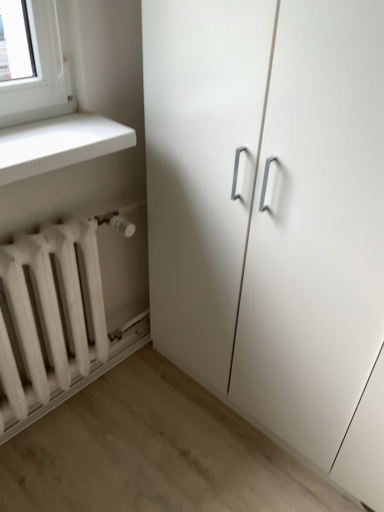
Locate an element on the screen. The width and height of the screenshot is (384, 512). white matte cabinet at center is located at coordinates (273, 217).

Describe the element at coordinates (273, 217) in the screenshot. The width and height of the screenshot is (384, 512). I see `white matte cabinet at center` at that location.

Measure the distance between white matte cabinet at center and camera.

A distance of 28.85 inches exists between white matte cabinet at center and camera.

Locate an element on the screen. The height and width of the screenshot is (512, 384). white matte radiator at lower left is located at coordinates (49, 318).

What do you see at coordinates (49, 318) in the screenshot? The width and height of the screenshot is (384, 512). I see `white matte radiator at lower left` at bounding box center [49, 318].

The width and height of the screenshot is (384, 512). Find the location of `white matte cabinet at center`. white matte cabinet at center is located at coordinates (273, 217).

Is white matte cabinet at center at the right side of white matte radiator at lower left?

Yes.

In the image, is white matte cabinet at center positioned in front of or behind white matte radiator at lower left?

Visually, white matte cabinet at center is located in front of white matte radiator at lower left.

Does point (163, 106) come farther from viewer compared to point (89, 270)?

No.

From the image's perspective, which object appears higher, white matte cabinet at center or white matte radiator at lower left?

white matte cabinet at center is shown above in the image.

From the picture: From a real-world perspective, between white matte cabinet at center and white matte radiator at lower left, who is vertically lower?

In real-world perspective, white matte radiator at lower left is lower.

Looking at their sizes, would you say white matte cabinet at center is wider or thinner than white matte radiator at lower left?

In the image, white matte cabinet at center appears to be wider than white matte radiator at lower left.

Considering the sizes of objects white matte cabinet at center and white matte radiator at lower left in the image provided, who is taller, white matte cabinet at center or white matte radiator at lower left?

Standing taller between the two is white matte cabinet at center.

Is white matte cabinet at center smaller than white matte radiator at lower left?

Actually, white matte cabinet at center might be larger than white matte radiator at lower left.

Is white matte cabinet at center inside or outside of white matte radiator at lower left?

white matte cabinet at center is not inside white matte radiator at lower left, it's outside.

Is white matte cabinet at center touching white matte radiator at lower left?

white matte cabinet at center and white matte radiator at lower left are not in contact.

Does white matte cabinet at center turn towards white matte radiator at lower left?

Yes, white matte cabinet at center is aimed at white matte radiator at lower left.

Based on the photo, how many degrees apart are the facing directions of white matte cabinet at center and white matte radiator at lower left?

There is a 90.7-degree angle between the facing directions of white matte cabinet at center and white matte radiator at lower left.

Where is `cupboard located in front of the white matte radiator at lower left`? cupboard located in front of the white matte radiator at lower left is located at coordinates (273, 217).

Considering the relative positions of white matte radiator at lower left and white matte cabinet at center in the image provided, is white matte radiator at lower left to the right of white matte cabinet at center from the viewer's perspective?

Incorrect, white matte radiator at lower left is not on the right side of white matte cabinet at center.

Considering the relative positions of white matte radiator at lower left and white matte cabinet at center in the image provided, is white matte radiator at lower left behind white matte cabinet at center?

Yes, white matte radiator at lower left is further from the viewer.

Considering the points (53, 244) and (372, 275), which point is behind, point (53, 244) or point (372, 275)?

The point (53, 244) is more distant.

From the image's perspective, is white matte radiator at lower left over white matte cabinet at center?

Actually, white matte radiator at lower left appears below white matte cabinet at center in the image.

From a real-world perspective, relative to white matte cabinet at center, is white matte radiator at lower left vertically above or below?

Clearly, from a real-world perspective, white matte radiator at lower left is below white matte cabinet at center.

Does white matte radiator at lower left have a lesser width compared to white matte cabinet at center?

Yes, white matte radiator at lower left is thinner than white matte cabinet at center.

Considering the relative sizes of white matte radiator at lower left and white matte cabinet at center in the image provided, is white matte radiator at lower left shorter than white matte cabinet at center?

Correct, white matte radiator at lower left is not as tall as white matte cabinet at center.

Is white matte radiator at lower left bigger than white matte cabinet at center?

Incorrect, white matte radiator at lower left is not larger than white matte cabinet at center.

Is white matte radiator at lower left located outside white matte cabinet at center?

Indeed, white matte radiator at lower left is completely outside white matte cabinet at center.

Are white matte radiator at lower left and white matte cabinet at center located far from each other?

white matte radiator at lower left is actually quite close to white matte cabinet at center.

Is white matte radiator at lower left aimed at white matte cabinet at center?

No, white matte radiator at lower left is not oriented towards white matte cabinet at center.

How much distance is there between white matte radiator at lower left and white matte cabinet at center?

The distance of white matte radiator at lower left from white matte cabinet at center is 20.99 inches.

Image resolution: width=384 pixels, height=512 pixels. What are the coordinates of `cupboard above the white matte radiator at lower left (from the image's perspective)` in the screenshot? It's located at (273, 217).

Find the location of a particular element. Image resolution: width=384 pixels, height=512 pixels. cupboard that appears above the white matte radiator at lower left (from a real-world perspective) is located at coordinates (273, 217).

Identify the location of radiator below the white matte cabinet at center (from the image's perspective). (49, 318).